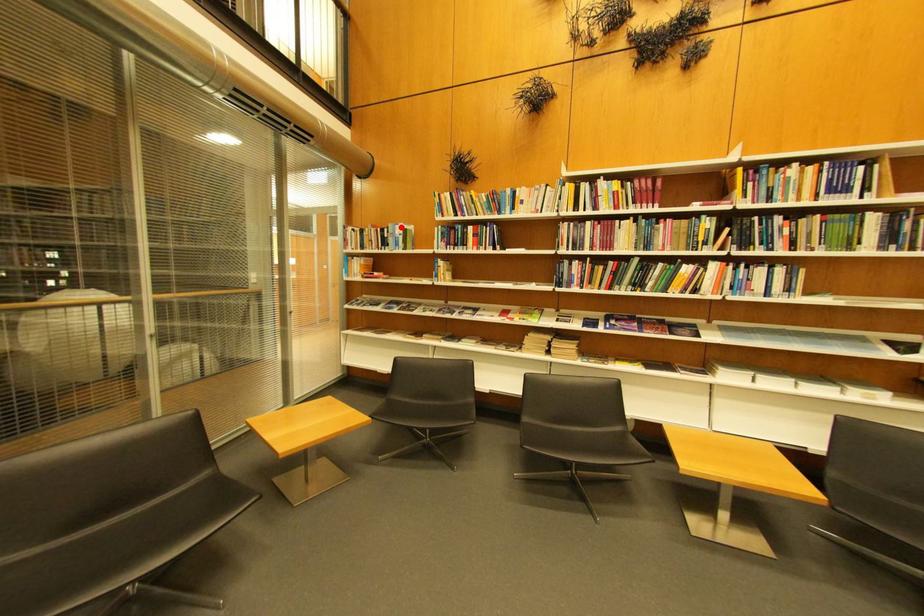
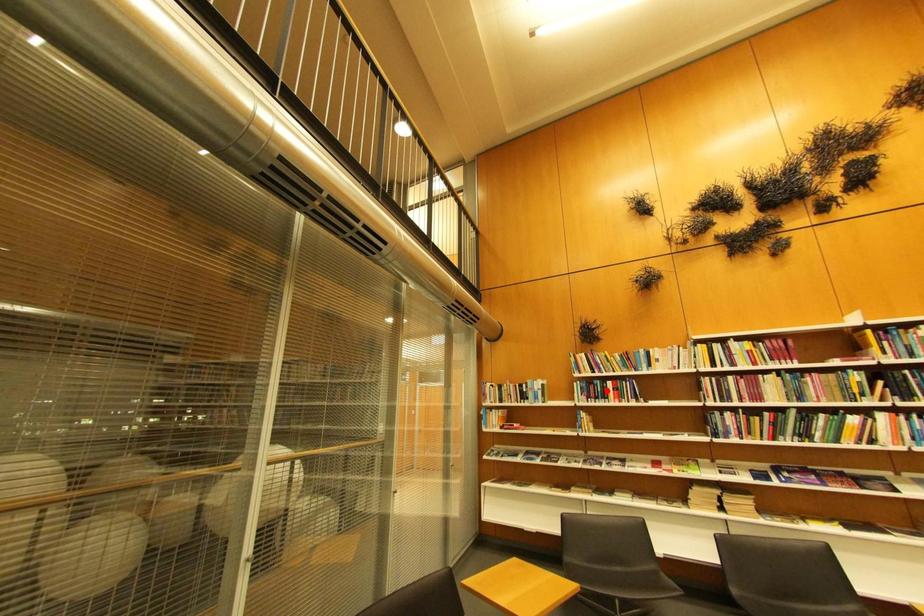
I am providing you with two images of the same scene from different viewpoints. A red point is marked on the first image and another point is marked on the second image. Is the red point in image1 aligned with the point shown in image2?

No